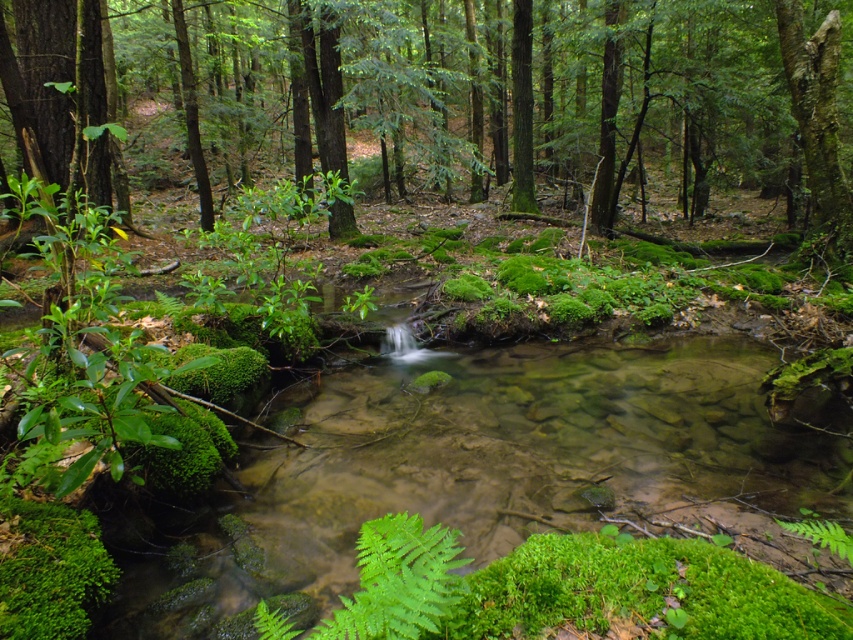
You are standing in the forest scene looking at the two points marked in the image. Which point, point (x=7, y=77) or point (x=817, y=198), is nearer to you?

Point (x=7, y=77) is closer to the camera than point (x=817, y=198), so it is the nearer one.

You are a hiker trying to navigate through the forest. You notice a green mossy tree at center and a smooth bark tree at upper right. Which tree would you choose to rest against if you want to lean against a larger tree?

The green mossy tree at center has a larger size compared to the smooth bark tree at upper right, so you should choose the green mossy tree at center to rest against.

Consider the image. You are a hiker trying to determine which tree has a thicker trunk between the green mossy tree at center and the smooth bark tree at upper right. Based on the scene, which tree likely has a thicker trunk?

The green mossy tree at center might be wider than smooth bark tree at upper right, so it likely has a thicker trunk.